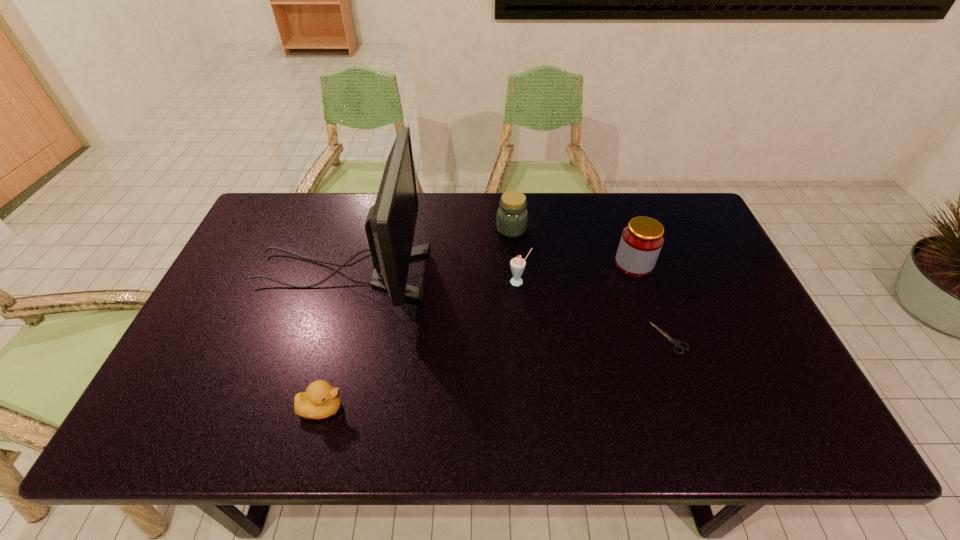
Locate an element on the screen. vacant area at the near edge of the desktop is located at coordinates (428, 428).

I want to click on free location at the left edge, so click(197, 342).

This screenshot has width=960, height=540. Identify the location of vacant region at the right edge of the desktop. (766, 364).

Identify the location of free point between the farther jar and the nearest object. The image size is (960, 540). (417, 319).

The image size is (960, 540). What are the coordinates of `free area in between the milkshake and the nearer jar` in the screenshot? It's located at 577,273.

This screenshot has height=540, width=960. Find the location of `free space between the right jar and the tallest object`. free space between the right jar and the tallest object is located at coordinates (488, 268).

Where is `free space between the nearer jar and the shortest object`? The image size is (960, 540). free space between the nearer jar and the shortest object is located at coordinates (652, 301).

In order to click on empty space that is in between the farther jar and the nearest object in this screenshot , I will do `click(417, 319)`.

Image resolution: width=960 pixels, height=540 pixels. Identify the location of vacant space in between the shortest object and the milkshake. 594,310.

Find the location of a particular element. This screenshot has height=540, width=960. free area in between the tallest object and the shears is located at coordinates (506, 305).